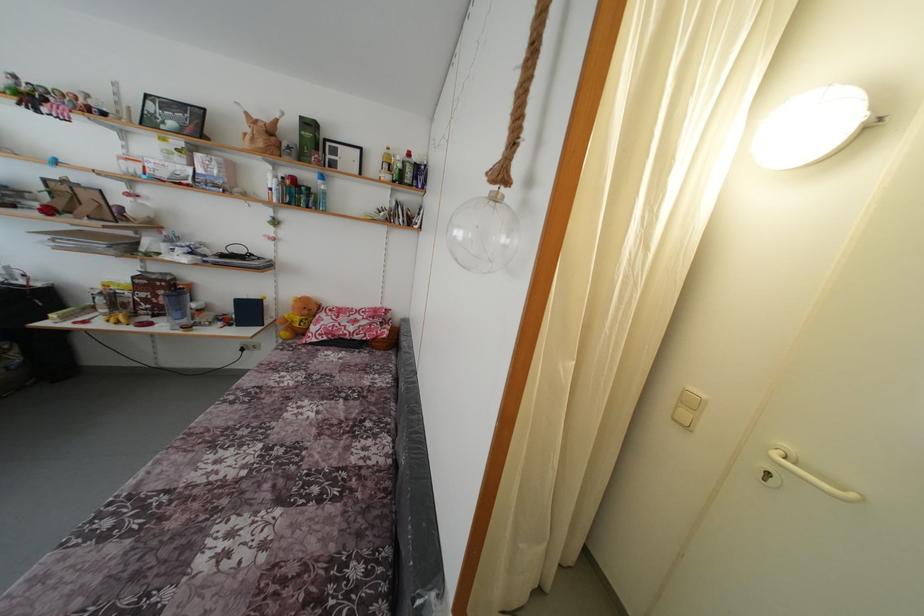
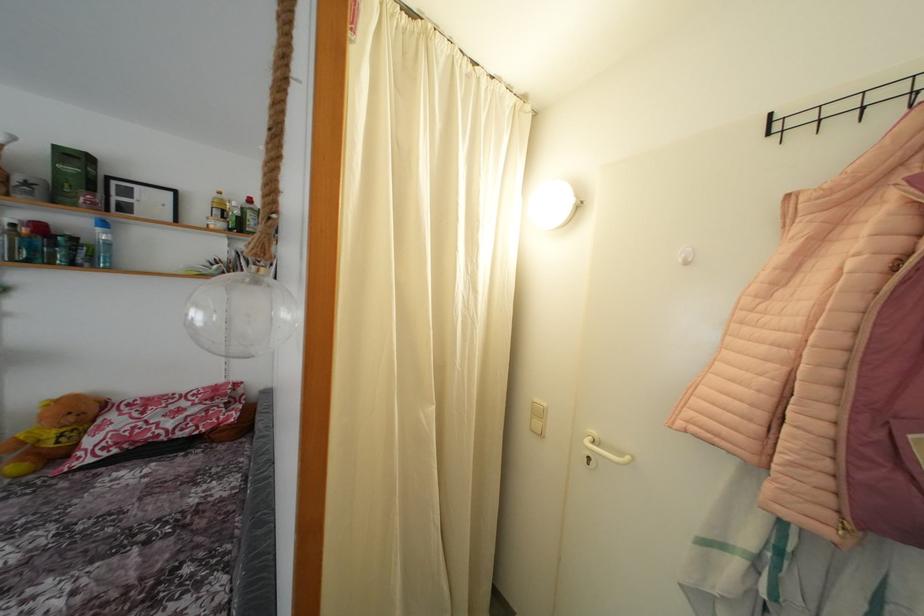
The point at [310,317] is marked in the first image. Where is the corresponding point in the second image?

(77, 424)